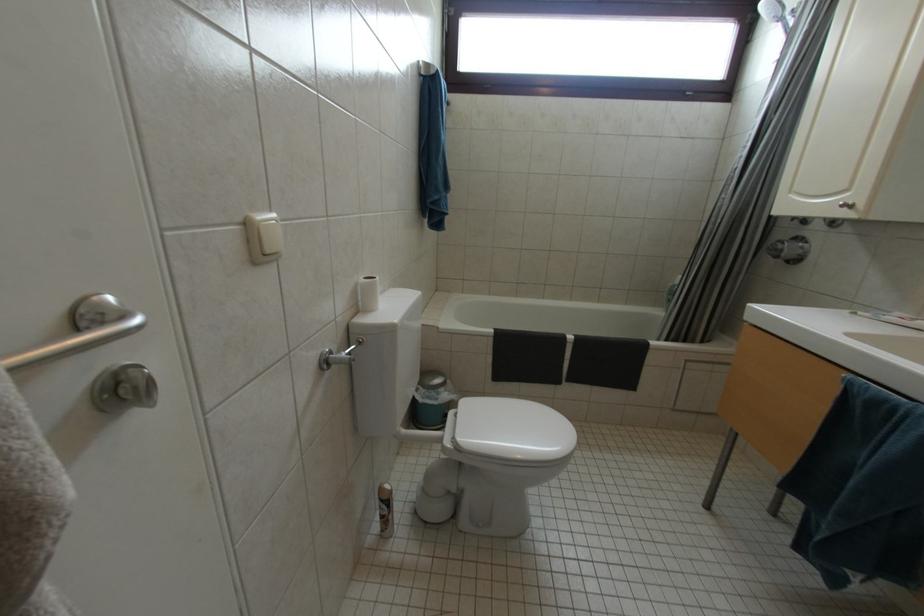
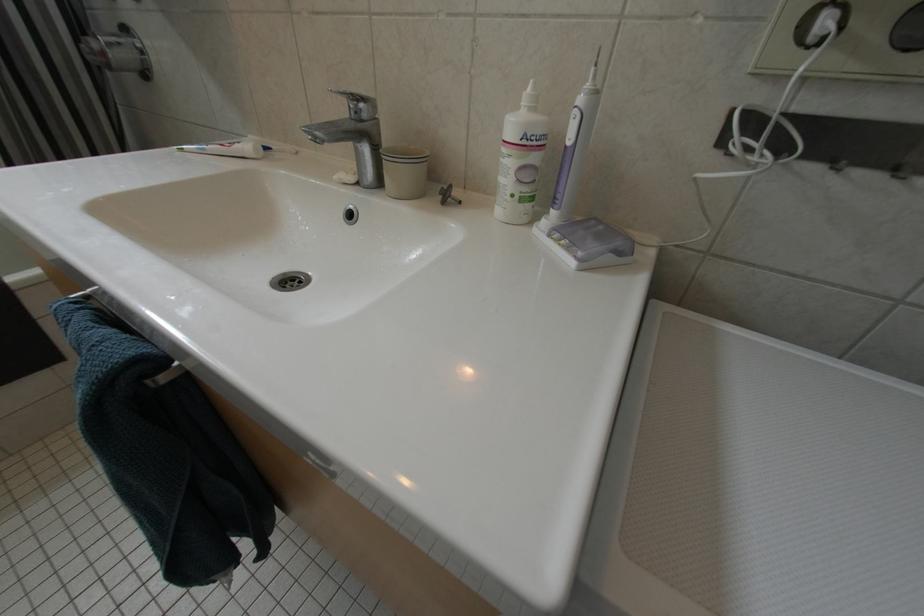
First-person continuous shooting, in which direction is the camera rotating?

The camera rotated toward right-down.